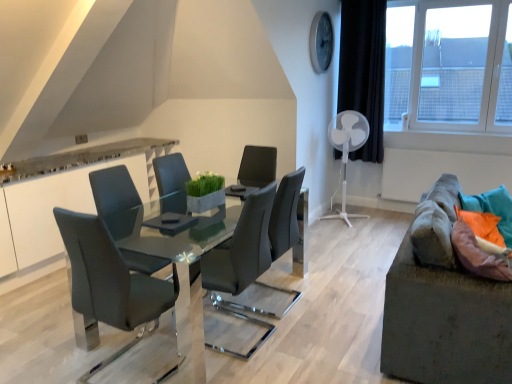
Question: Is the depth of matte gray chair at center, which is the second chair in front-to-back order, less than that of textured gray couch at right?

Choices:
 (A) yes
 (B) no

Answer: (B)

Question: Are matte gray chair at center, the 1th chair viewed from the right, and textured gray couch at right far apart?

Choices:
 (A) no
 (B) yes

Answer: (A)

Question: Does matte gray chair at center, the 1th chair viewed from the right, appear on the left side of textured gray couch at right?

Choices:
 (A) no
 (B) yes

Answer: (B)

Question: Is matte gray chair at center, which is the second chair in front-to-back order, next to textured gray couch at right and touching it?

Choices:
 (A) no
 (B) yes

Answer: (A)

Question: From a real-world perspective, is matte gray chair at center, the first chair in the back-to-front sequence, located higher than textured gray couch at right?

Choices:
 (A) no
 (B) yes

Answer: (B)

Question: Is matte gray chair at center, arranged as the 2th chair when viewed from the left, situated inside white plastic mechanical fan at right or outside?

Choices:
 (A) outside
 (B) inside

Answer: (A)

Question: Considering the relative positions of matte gray chair at center, the first chair in the back-to-front sequence, and white plastic mechanical fan at right in the image provided, is matte gray chair at center, the first chair in the back-to-front sequence, to the left or to the right of white plastic mechanical fan at right?

Choices:
 (A) left
 (B) right

Answer: (A)

Question: Is point (229, 273) closer or farther from the camera than point (343, 142)?

Choices:
 (A) closer
 (B) farther

Answer: (A)

Question: Considering the positions of matte gray chair at center, which is the second chair in front-to-back order, and white plastic mechanical fan at right in the image, is matte gray chair at center, which is the second chair in front-to-back order, taller or shorter than white plastic mechanical fan at right?

Choices:
 (A) tall
 (B) short

Answer: (B)

Question: Is matte gray chair at center, the 1th chair viewed from the right, wider or thinner than orange fabric pillow at right?

Choices:
 (A) wide
 (B) thin

Answer: (A)

Question: Considering the positions of matte gray chair at center, which is the second chair in front-to-back order, and orange fabric pillow at right in the image, is matte gray chair at center, which is the second chair in front-to-back order, bigger or smaller than orange fabric pillow at right?

Choices:
 (A) small
 (B) big

Answer: (B)

Question: Considering the positions of matte gray chair at center, which is the second chair in front-to-back order, and orange fabric pillow at right in the image, is matte gray chair at center, which is the second chair in front-to-back order, taller or shorter than orange fabric pillow at right?

Choices:
 (A) short
 (B) tall

Answer: (B)

Question: Is matte gray chair at center, the 1th chair viewed from the right, spatially inside orange fabric pillow at right, or outside of it?

Choices:
 (A) outside
 (B) inside

Answer: (A)

Question: From the image's perspective, is transparent glass window at upper right above or below matte gray chair at center, the 1th chair viewed from the right?

Choices:
 (A) below
 (B) above

Answer: (B)

Question: From their relative heights in the image, would you say transparent glass window at upper right is taller or shorter than matte gray chair at center, arranged as the 2th chair when viewed from the left?

Choices:
 (A) tall
 (B) short

Answer: (A)